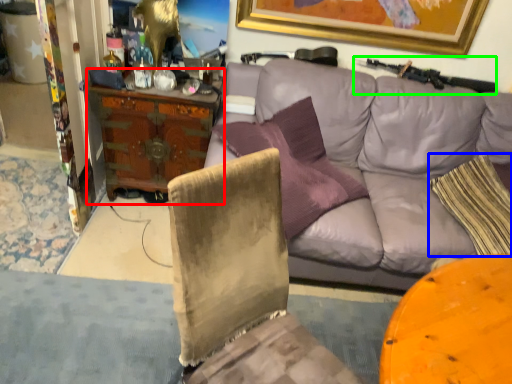
Question: Considering the real-world distances, which object is farthest from desk (highlighted by a red box)? pillow (highlighted by a blue box) or shotgun (highlighted by a green box)?

Choices:
 (A) pillow
 (B) shotgun

Answer: (A)